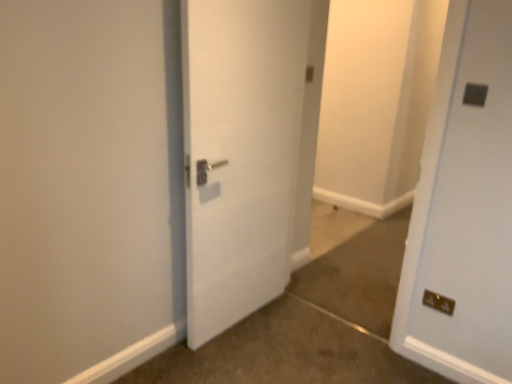
Question: From the image's perspective, is dark gray plastic electric outlet at upper right, which appears as the 2th electric outlet when ordered from the bottom, above metallic gold electrical outlet at lower right, placed as the first electric outlet when sorted from back to front?

Choices:
 (A) no
 (B) yes

Answer: (B)

Question: Does dark gray plastic electric outlet at upper right, placed as the 2th electric outlet when sorted from back to front, lie in front of metallic gold electrical outlet at lower right, the first electric outlet from the bottom?

Choices:
 (A) yes
 (B) no

Answer: (A)

Question: Is dark gray plastic electric outlet at upper right, which appears as the 2th electric outlet when ordered from the bottom, shorter than metallic gold electrical outlet at lower right, placed as the first electric outlet when sorted from back to front?

Choices:
 (A) yes
 (B) no

Answer: (A)

Question: Does dark gray plastic electric outlet at upper right, the 1th electric outlet viewed from the front, appear on the left side of metallic gold electrical outlet at lower right, the first electric outlet from the bottom?

Choices:
 (A) no
 (B) yes

Answer: (A)

Question: Is dark gray plastic electric outlet at upper right, which is the first electric outlet from top to bottom, thinner than metallic gold electrical outlet at lower right, placed as the first electric outlet when sorted from back to front?

Choices:
 (A) no
 (B) yes

Answer: (A)

Question: Does dark gray plastic electric outlet at upper right, which appears as the 2th electric outlet when ordered from the bottom, appear on the right side of metallic gold electrical outlet at lower right, the first electric outlet from the bottom?

Choices:
 (A) no
 (B) yes

Answer: (B)

Question: Is the depth of metallic gold electrical outlet at lower right, which is the 2th electric outlet in front-to-back order, greater than that of white matte door at center?

Choices:
 (A) no
 (B) yes

Answer: (B)

Question: Can you confirm if metallic gold electrical outlet at lower right, which is counted as the second electric outlet, starting from the top, is taller than white matte door at center?

Choices:
 (A) yes
 (B) no

Answer: (B)

Question: From the image's perspective, is metallic gold electrical outlet at lower right, placed as the first electric outlet when sorted from back to front, located above white matte door at center?

Choices:
 (A) no
 (B) yes

Answer: (A)

Question: From the image's perspective, is metallic gold electrical outlet at lower right, which is the 2th electric outlet in front-to-back order, under white matte door at center?

Choices:
 (A) no
 (B) yes

Answer: (B)

Question: Is metallic gold electrical outlet at lower right, the first electric outlet from the bottom, outside of white matte door at center?

Choices:
 (A) yes
 (B) no

Answer: (A)

Question: Can you confirm if metallic gold electrical outlet at lower right, which is the 2th electric outlet in front-to-back order, is positioned to the right of white matte door at center?

Choices:
 (A) no
 (B) yes

Answer: (B)

Question: Is dark gray plastic electric outlet at upper right, the 1th electric outlet viewed from the front, with brown carpet at lower right?

Choices:
 (A) no
 (B) yes

Answer: (A)